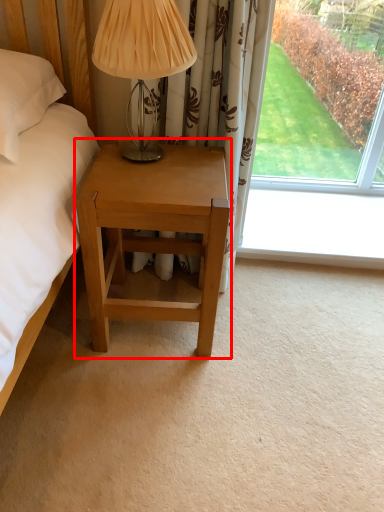
Question: Observing the image, what is the correct spatial positioning of nightstand (annotated by the red box) in reference to table lamp?

Choices:
 (A) left
 (B) right

Answer: (B)